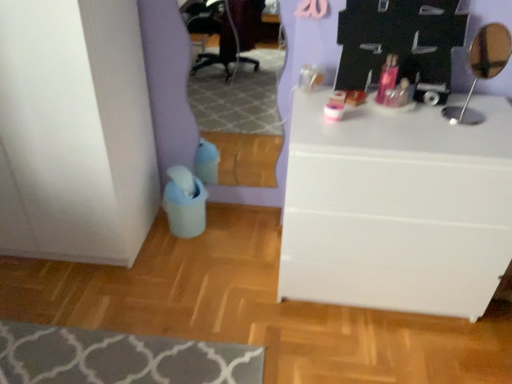
The image size is (512, 384). Identify the location of vacant space that is in between white matte chest of drawers at center and gray textured rug at lower left. (254, 317).